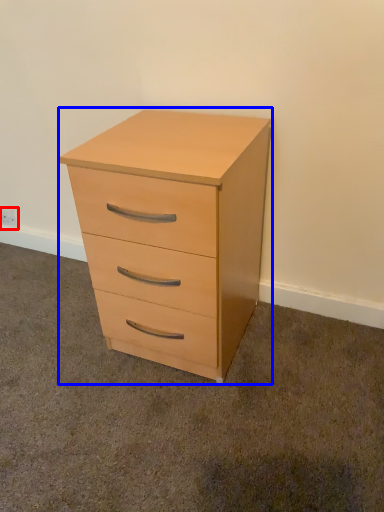
Question: Which object appears farthest to the camera in this image, electric outlet (highlighted by a red box) or chest of drawers (highlighted by a blue box)?

Choices:
 (A) electric outlet
 (B) chest of drawers

Answer: (A)